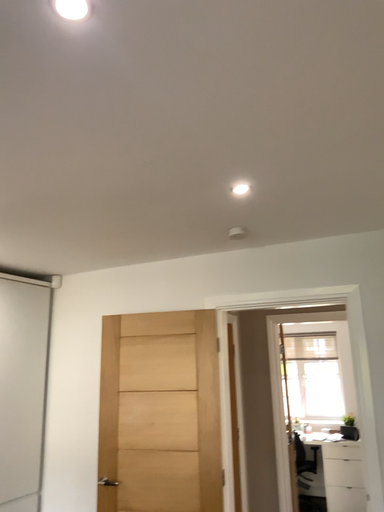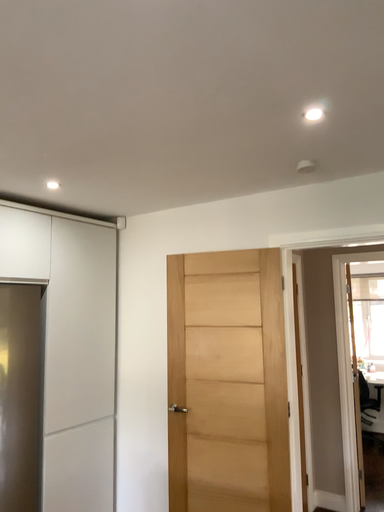
Question: How did the camera likely rotate when shooting the video?

Choices:
 (A) rotated left
 (B) rotated right

Answer: (A)